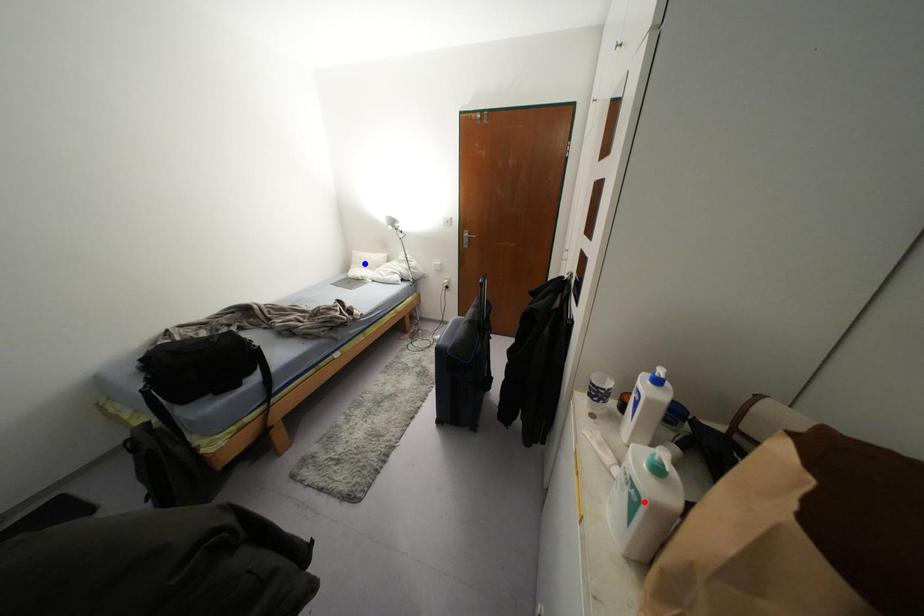
Question: Which of the two points in the image is closer to the camera?

Choices:
 (A) Blue point is closer.
 (B) Red point is closer.

Answer: (B)